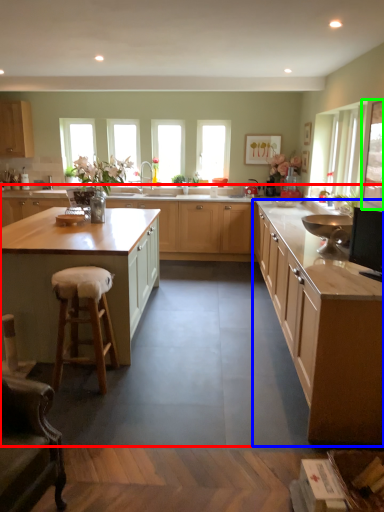
Question: Which object is the closest to the cabinetry (highlighted by a red box)? Choose among these: cabinetry (highlighted by a blue box) or window screen (highlighted by a green box).

Choices:
 (A) cabinetry
 (B) window screen

Answer: (A)